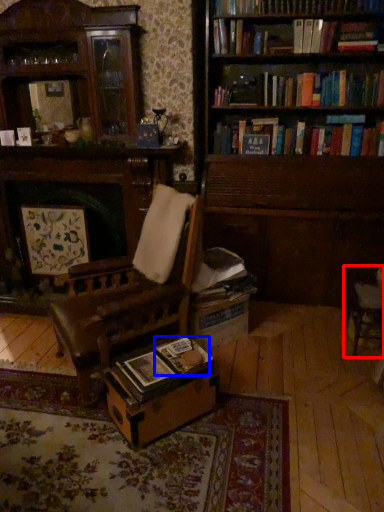
Question: Which object is further to the camera taking this photo, chair (highlighted by a red box) or paperback book (highlighted by a blue box)?

Choices:
 (A) chair
 (B) paperback book

Answer: (A)